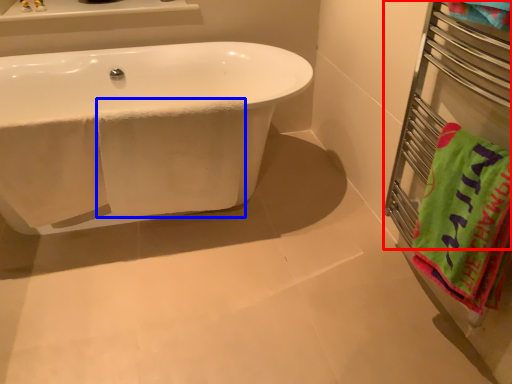
Question: Which of the following is the farthest to the observer, balustrade (highlighted by a red box) or bath towel (highlighted by a blue box)?

Choices:
 (A) balustrade
 (B) bath towel

Answer: (B)